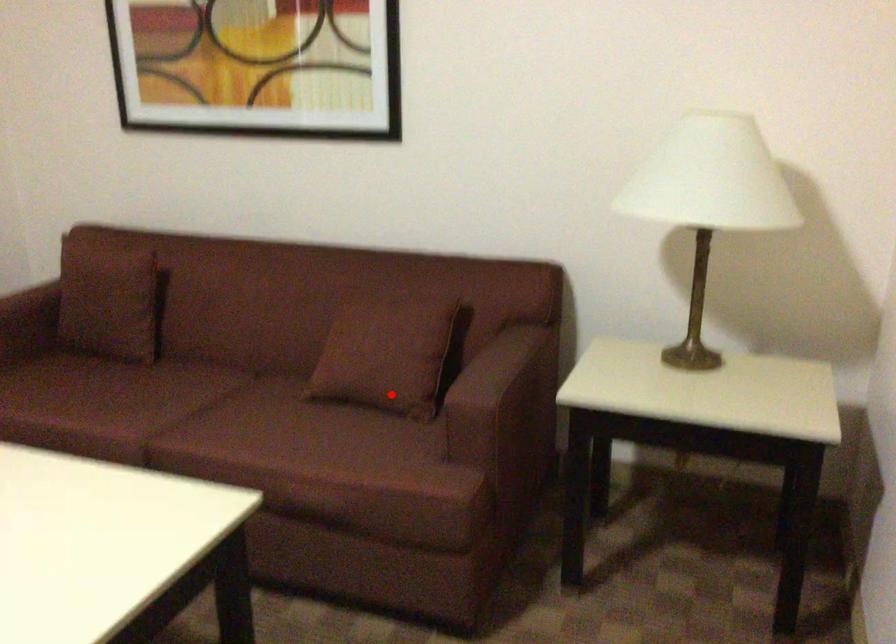
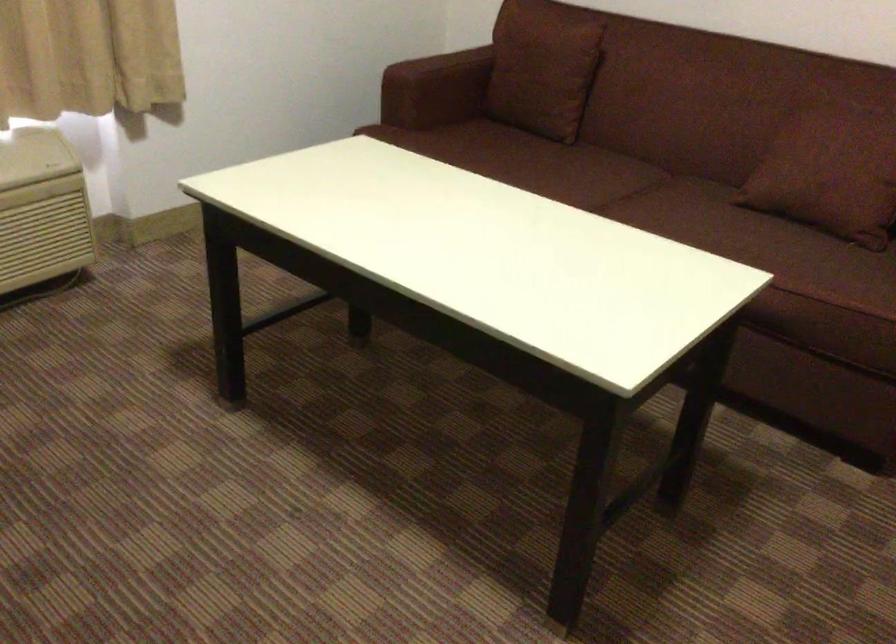
The point at the highlighted location is marked in the first image. Where is the corresponding point in the second image?

(842, 207)